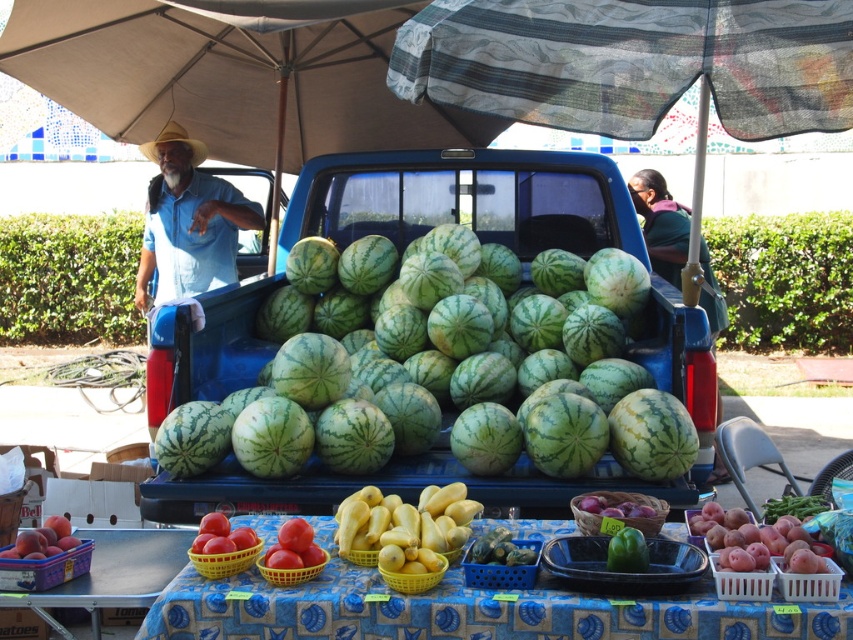
You are a customer at the market and want to pick up the yellow matte squash at center. Which direction should you move relative to the smooth plastic table at center?

The smooth plastic table at center is in front of the yellow matte squash at center, so you should move backward away from the table to reach the squash.

You are a customer at the market and want to know if the light blue denim shirt at left can fit into a bag that can only hold items wider than the smooth red tomato at lower left. Can it fit?

The light blue denim shirt at left is wider than the smooth red tomato at lower left, so it can fit into the bag that requires items wider than the smooth red tomato at lower left.

What is the relationship in height between the light blue denim shirt at left and the smooth red tomato at lower left in the market scene?

The light blue denim shirt at left is taller than the smooth red tomato at lower left.